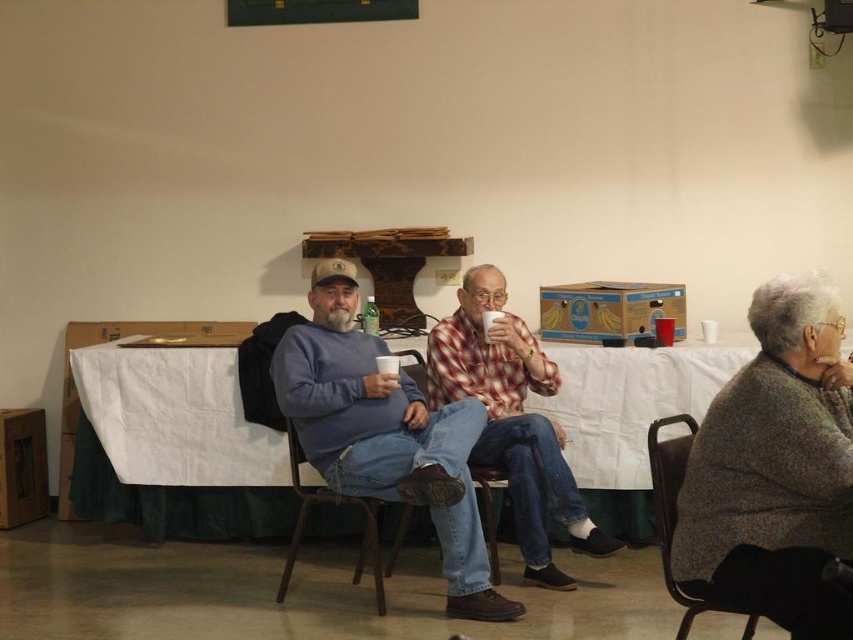
The image size is (853, 640). Describe the element at coordinates (175, 445) in the screenshot. I see `white cloth-covered table at center` at that location.

Who is shorter, white cloth-covered table at center or denim fabric chair at center?

Standing shorter between the two is denim fabric chair at center.

You are a GUI agent. You are given a task and a screenshot of the screen. Output one action in this format:
    pyautogui.click(x=<x>, y=<y>)
    Task: Click on the white cloth-covered table at center
    The image size is (853, 640).
    Given the screenshot: What is the action you would take?
    pyautogui.click(x=175, y=445)

Does white cloth-covered table at center appear under dark gray fabric chair at lower right?

Correct, white cloth-covered table at center is located below dark gray fabric chair at lower right.

You are a GUI agent. You are given a task and a screenshot of the screen. Output one action in this format:
    pyautogui.click(x=<x>, y=<y>)
    Task: Click on the white cloth-covered table at center
    Image resolution: width=853 pixels, height=640 pixels.
    Given the screenshot: What is the action you would take?
    pyautogui.click(x=175, y=445)

Is plaid fabric shirt at center bigger than metallic brown chair at center?

Yes.

Is plaid fabric shirt at center below metallic brown chair at center?

Actually, plaid fabric shirt at center is above metallic brown chair at center.

This screenshot has width=853, height=640. Describe the element at coordinates (512, 420) in the screenshot. I see `plaid fabric shirt at center` at that location.

Where is `plaid fabric shirt at center`? plaid fabric shirt at center is located at coordinates (512, 420).